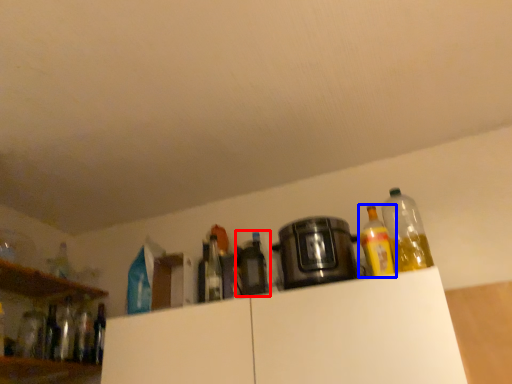
Question: Which point is further to the camera, bottle (highlighted by a red box) or bottle (highlighted by a blue box)?

Choices:
 (A) bottle
 (B) bottle

Answer: (A)